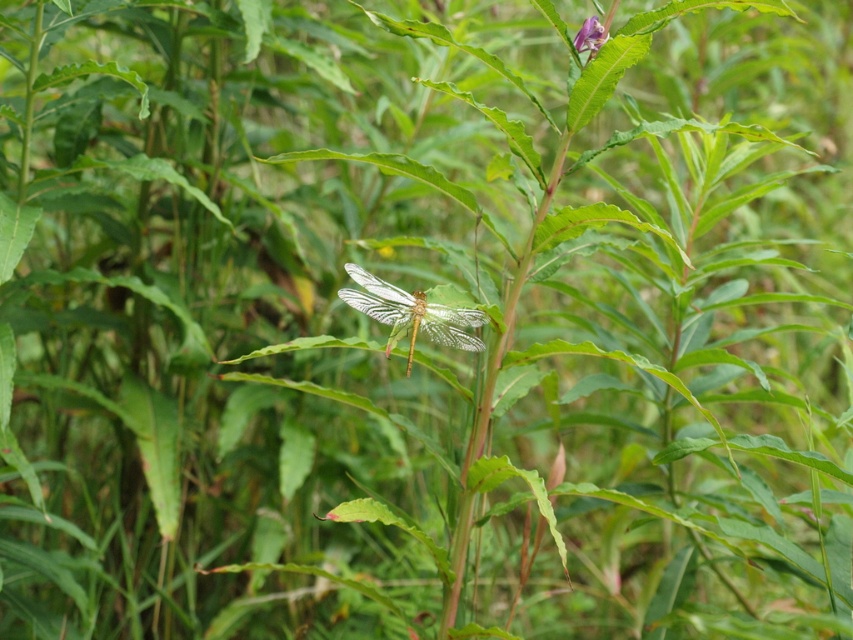
Does translucent glass dragonfly at center come behind purple matte flower at upper right?

No, translucent glass dragonfly at center is in front of purple matte flower at upper right.

Is point (357, 275) farther from camera compared to point (576, 38)?

No, (357, 275) is in front of (576, 38).

You are a GUI agent. You are given a task and a screenshot of the screen. Output one action in this format:
    pyautogui.click(x=<x>, y=<y>)
    Task: Click on the translucent glass dragonfly at center
    The width and height of the screenshot is (853, 640).
    Given the screenshot: What is the action you would take?
    pyautogui.click(x=412, y=314)